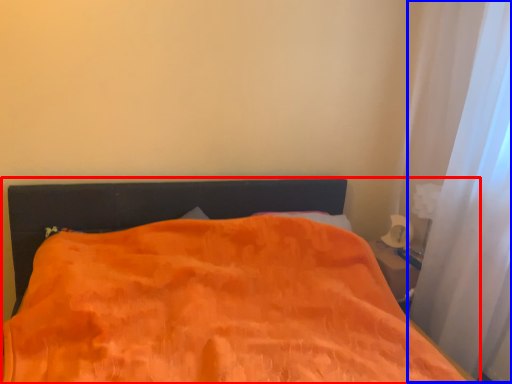
Question: Which object is further to the camera taking this photo, bed (highlighted by a red box) or curtain (highlighted by a blue box)?

Choices:
 (A) bed
 (B) curtain

Answer: (B)